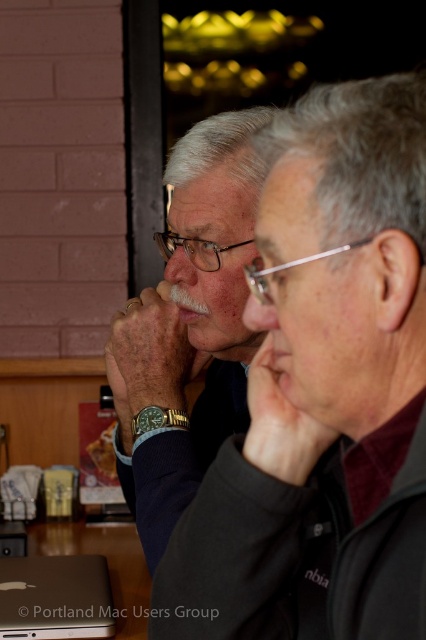
You are standing in the room and want to move from the point at the bottom right corner to the point at the upper left corner. Which direction should you move? The two points are labeled as point 1 and point 2 in the image. The coordinates are given in the format of x,y where x is the horizontal axis and y is the vertical axis. The origin is at the bottom left corner of the image. The first point is at (293, 468) and the second point is at (181, 307). The question is to determine the direction from the

To move from point 1 to point 2, you should move diagonally to the left and upwards since point 2 has a lower x coordinate and a higher y coordinate compared to point 1. The coordinates of point 1 are (293, 468) and point 2 are (181, 307). Since the origin is at the bottom left, increasing y means moving upwards and decreasing x means moving to the left. Therefore, moving left and up from point 1 will reach point 2.

You are a photographer setting up a shot of the two people in the scene. You want to place a small tripod exactly where the silver metallic laptop at lower left is located. Since the laptop is at point 0.934, 0.129, can you confirm the exact coordinates to place the tripod?

The silver metallic laptop at lower left is located at coordinates [54,596], so you should place the tripod at those exact coordinates.

You are a photographer trying to capture a clear photo of the matte black nose at center without the silver metallic laptop at lower left blocking it. What should you do?

Move the camera position so that the matte black nose at center is no longer behind the silver metallic laptop at lower left.